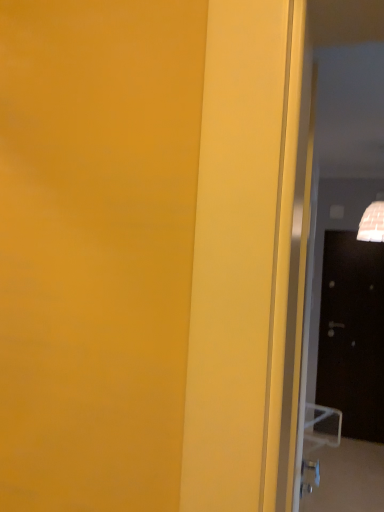
You are a GUI agent. You are given a task and a screenshot of the screen. Output one action in this format:
    pyautogui.click(x=<x>, y=<y>)
    Task: Click on the black glossy door at right
    The image size is (384, 512).
    Given the screenshot: What is the action you would take?
    pyautogui.click(x=352, y=334)

Describe the element at coordinates (352, 334) in the screenshot. This screenshot has height=512, width=384. I see `black glossy door at right` at that location.

Image resolution: width=384 pixels, height=512 pixels. In order to click on black glossy door at right in this screenshot , I will do `click(352, 334)`.